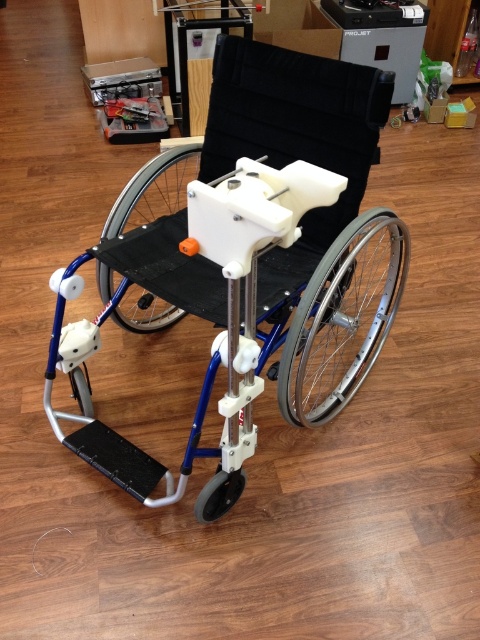
Consider the image. Is silver metallic wheelchair at center positioned at the back of black rubber wheel at lower center?

No, it is not.

Can you confirm if silver metallic wheelchair at center is positioned below black rubber wheel at lower center?

No, silver metallic wheelchair at center is not below black rubber wheel at lower center.

I want to click on silver metallic wheelchair at center, so click(x=255, y=257).

The width and height of the screenshot is (480, 640). I want to click on silver metallic wheelchair at center, so click(x=255, y=257).

Does white plastic wheel at center have a smaller size compared to black rubber wheel at lower center?

Actually, white plastic wheel at center might be larger than black rubber wheel at lower center.

Can you confirm if white plastic wheel at center is thinner than black rubber wheel at lower center?

In fact, white plastic wheel at center might be wider than black rubber wheel at lower center.

Who is more forward, (160, 163) or (211, 509)?

Positioned in front is point (211, 509).

Where is `white plastic wheel at center`? Image resolution: width=480 pixels, height=640 pixels. white plastic wheel at center is located at coordinates (154, 189).

Who is lower down, silver metallic wheelchair at center or silver metallic wheel at right?

silver metallic wheel at right is below.

Is point (227, 320) less distant than point (327, 276)?

Yes, it is in front of point (327, 276).

The height and width of the screenshot is (640, 480). I want to click on silver metallic wheelchair at center, so click(255, 257).